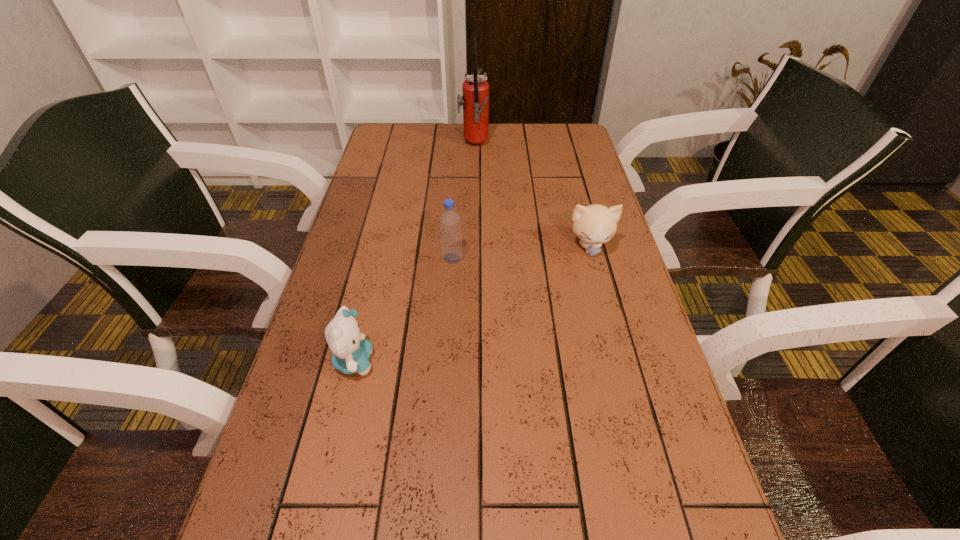
This screenshot has width=960, height=540. Identify the location of the tallest object. (475, 100).

I want to click on the farthest object, so click(x=475, y=100).

The height and width of the screenshot is (540, 960). I want to click on bottle, so tap(450, 228).

Find the location of a particular element. The width and height of the screenshot is (960, 540). the farther kitten is located at coordinates (595, 224).

Find the location of a particular element. The width and height of the screenshot is (960, 540). the right kitten is located at coordinates (595, 224).

Where is `the leftmost object`? Image resolution: width=960 pixels, height=540 pixels. the leftmost object is located at coordinates (351, 351).

Where is `the nearest object`? This screenshot has height=540, width=960. the nearest object is located at coordinates click(351, 351).

You are a GUI agent. You are given a task and a screenshot of the screen. Output one action in this format:
    pyautogui.click(x=<x>, y=<y>)
    Task: Click on the vacant space located at the nozzle of the tallest object
    Image resolution: width=960 pixels, height=540 pixels.
    Given the screenshot: What is the action you would take?
    pyautogui.click(x=503, y=145)

Identify the location of vacant space situated on the left of the bottle. The height and width of the screenshot is (540, 960). (349, 258).

This screenshot has width=960, height=540. I want to click on vacant space located 0.310m on the face of the rightmost object, so click(x=620, y=361).